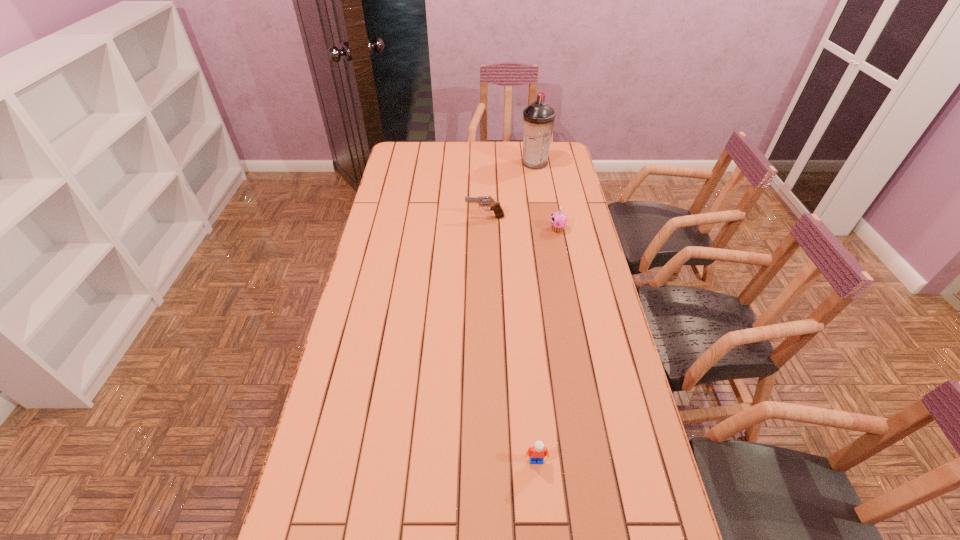
The height and width of the screenshot is (540, 960). I want to click on vacant point located between the Lego and the leftmost object, so click(511, 339).

At what (x,y) coordinates should I click in order to perform the action: click on vacant space in between the third farthest object and the pistol. Please return your answer as a coordinate pair (x, y). The height and width of the screenshot is (540, 960). Looking at the image, I should click on (521, 223).

The height and width of the screenshot is (540, 960). I want to click on empty space that is in between the farthest object and the pistol, so click(x=510, y=190).

The height and width of the screenshot is (540, 960). What are the coordinates of `free space between the cupcake and the tallest object` in the screenshot? It's located at (546, 196).

Choose which object is the second nearest neighbor to the leftmost object. Please provide its 2D coordinates. Your answer should be formatted as a tuple, i.e. [(x, y)], where the tuple contains the x and y coordinates of a point satisfying the conditions above.

[(538, 118)]

This screenshot has height=540, width=960. In order to click on object that stands as the second closest to the nearest object in this screenshot , I will do `click(495, 206)`.

The height and width of the screenshot is (540, 960). Find the location of `free space that satisfies the following two spatial constraints: 1. on the face of the second nearest object; 2. on the face of the nearest object`. free space that satisfies the following two spatial constraints: 1. on the face of the second nearest object; 2. on the face of the nearest object is located at coordinates (603, 460).

Locate an element on the screen. The width and height of the screenshot is (960, 540). vacant space that satisfies the following two spatial constraints: 1. on the face of the third farthest object; 2. on the face of the nearest object is located at coordinates 603,460.

At what (x,y) coordinates should I click in order to perform the action: click on vacant space that satisfies the following two spatial constraints: 1. on the face of the third farthest object; 2. on the face of the third object from right to left. Please return your answer as a coordinate pair (x, y). This screenshot has width=960, height=540. Looking at the image, I should click on (603, 460).

Locate an element on the screen. This screenshot has width=960, height=540. free spot that satisfies the following two spatial constraints: 1. on the face of the cupcake; 2. on the face of the second object from left to right is located at coordinates (603, 460).